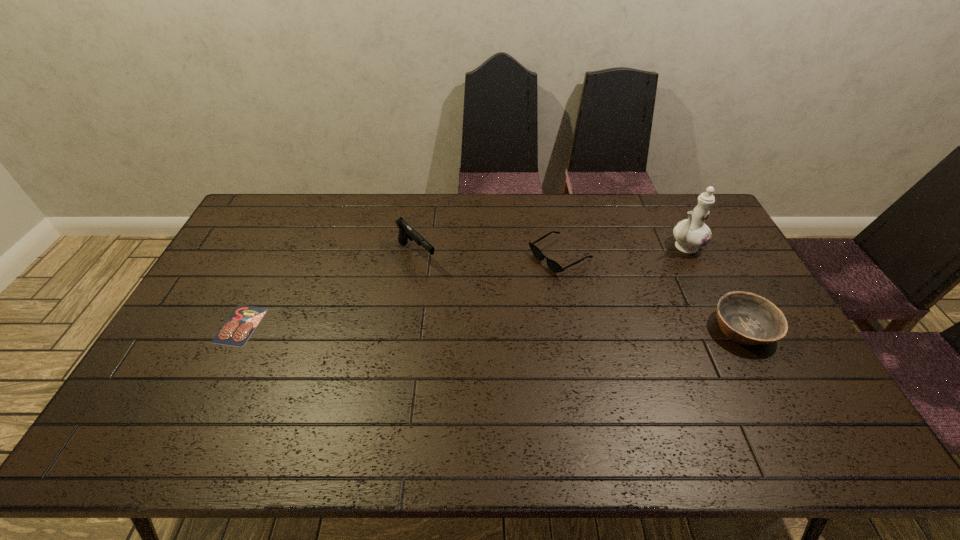
This screenshot has width=960, height=540. I want to click on free spot on the desktop that is between the salami and the bowl and is positioned at the spout of the tallest object, so click(x=564, y=327).

Where is `free space on the desktop that is between the shortest object and the bowl and is positioned at the aiming end of the gun`? free space on the desktop that is between the shortest object and the bowl and is positioned at the aiming end of the gun is located at coordinates (490, 327).

Where is `vacant space on the desktop that is between the shortest object and the bowl and is positioned on the front-facing side of the second shortest object`? vacant space on the desktop that is between the shortest object and the bowl and is positioned on the front-facing side of the second shortest object is located at coordinates (434, 326).